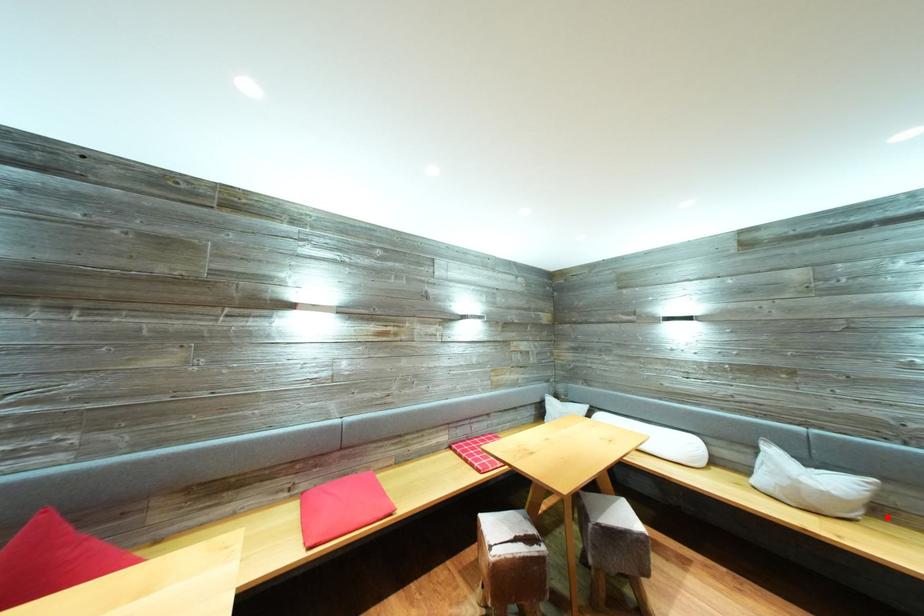
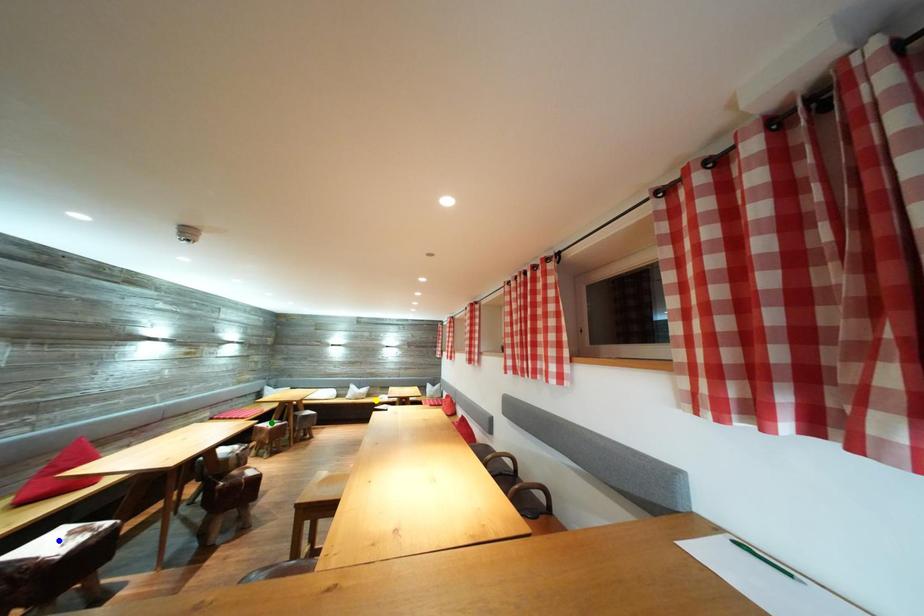
Question: I am providing you with two images of the same scene from different viewpoints. A red point is marked on the first image. You are given multiple points on the second image. In image 2, which mark is for the same physical point as the one in image 1?

Choices:
 (A) blue point
 (B) green point
 (C) yellow point

Answer: (C)